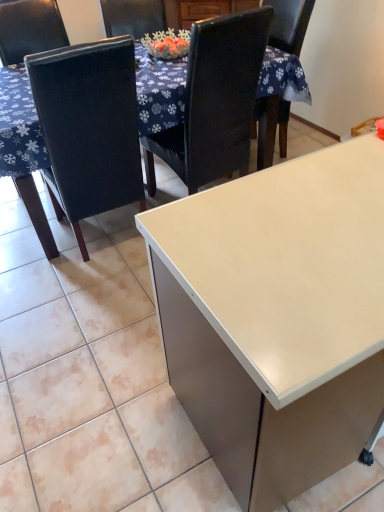
Question: Does white glossy desk at center turn towards black leather chair at upper center, placed as the 1th chair when sorted from right to left?

Choices:
 (A) yes
 (B) no

Answer: (B)

Question: Is white glossy desk at center positioned before black leather chair at upper center, placed as the 1th chair when sorted from right to left?

Choices:
 (A) no
 (B) yes

Answer: (B)

Question: Is white glossy desk at center to the right of black leather chair at upper center, placed as the 1th chair when sorted from right to left, from the viewer's perspective?

Choices:
 (A) yes
 (B) no

Answer: (A)

Question: Is white glossy desk at center outside of black leather chair at upper center, placed as the 1th chair when sorted from right to left?

Choices:
 (A) yes
 (B) no

Answer: (A)

Question: Is white glossy desk at center positioned far away from black leather chair at upper center, which ranks as the second chair in left-to-right order?

Choices:
 (A) no
 (B) yes

Answer: (B)

Question: Does white glossy desk at center have a greater width compared to black leather chair at upper center, placed as the 1th chair when sorted from right to left?

Choices:
 (A) no
 (B) yes

Answer: (B)

Question: From the image's perspective, is white glossy desk at center below white glossy table at upper center?

Choices:
 (A) yes
 (B) no

Answer: (A)

Question: Is white glossy desk at center closer to the viewer compared to white glossy table at upper center?

Choices:
 (A) yes
 (B) no

Answer: (A)

Question: Is white glossy table at upper center surrounded by white glossy desk at center?

Choices:
 (A) no
 (B) yes

Answer: (A)

Question: Does white glossy desk at center touch white glossy table at upper center?

Choices:
 (A) yes
 (B) no

Answer: (B)

Question: Could you tell me if white glossy desk at center is facing white glossy table at upper center?

Choices:
 (A) yes
 (B) no

Answer: (B)

Question: From the image's perspective, is white glossy desk at center on top of white glossy table at upper center?

Choices:
 (A) no
 (B) yes

Answer: (A)

Question: Would you consider matte black chair at left, the 2th chair from the right, to be distant from white glossy desk at center?

Choices:
 (A) yes
 (B) no

Answer: (A)